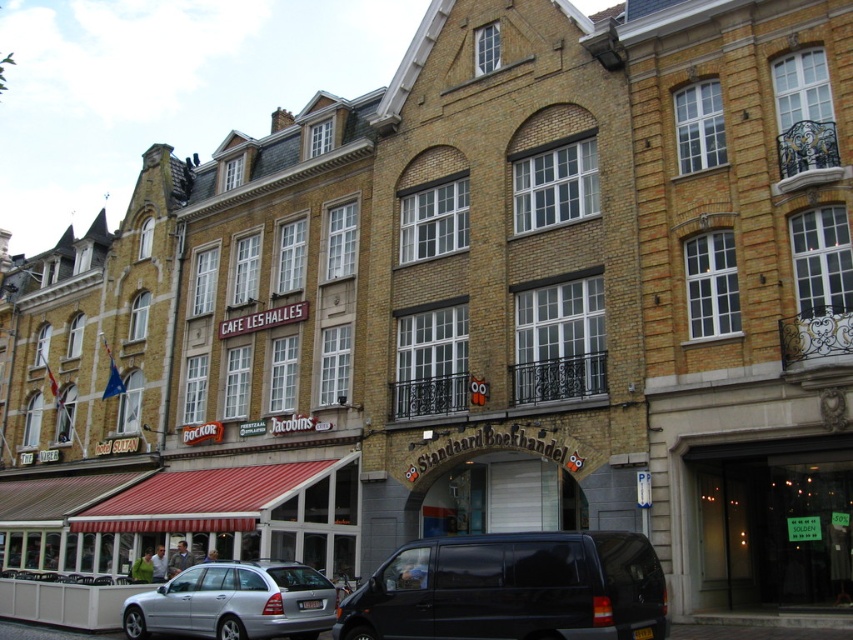
You are a delivery person needing to park your vehicle between the black matte van at center and the silver metallic car at center. Given that your delivery van is 5 meters long, can you fit it in the space between them?

The black matte van at center is larger in size than the silver metallic car at center, but the exact distance between them isn not specified. Without knowing the actual space available, it is impossible to determine if your 5 meter long delivery van would fit.

From the picture: You are a pedestrian standing on the sidewalk and want to cross the street to reach the bookstore. There is a black matte van at center and a silver metallic car at center blocking your path. Which vehicle should you move around first?

The black matte van at center is above the silver metallic car at center, so you should move around the silver metallic car at center first since it is lower and closer to your path.